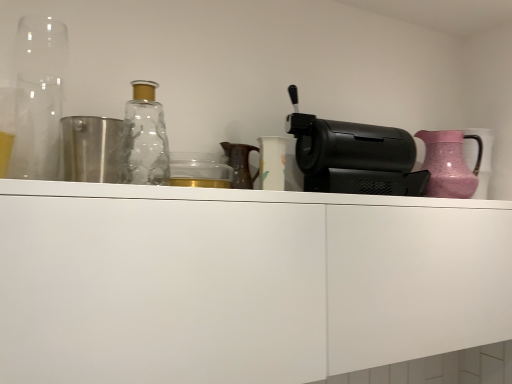
At what (x,y) coordinates should I click in order to perform the action: click on free spot below black plastic coffee machine at right (from a real-world perspective). Please return your answer as a coordinate pair (x, y). The image size is (512, 384). Looking at the image, I should click on (367, 189).